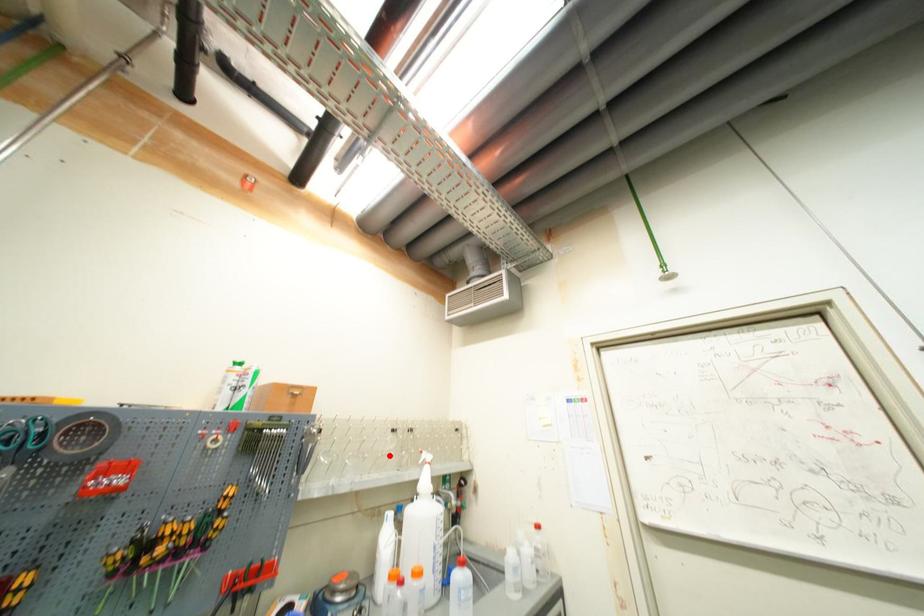
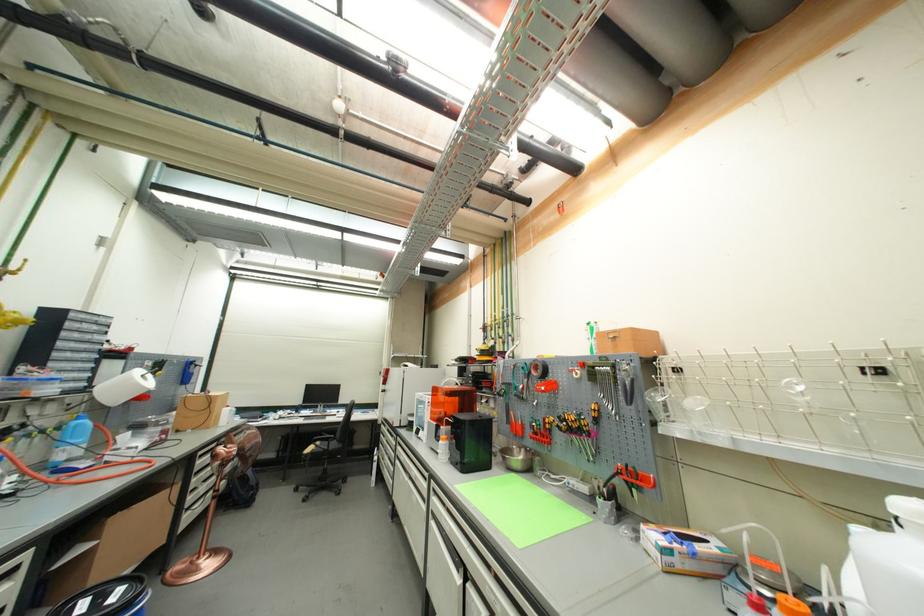
Locate, in the second image, the point that corresponds to the highlighted location in the first image.

(820, 413)